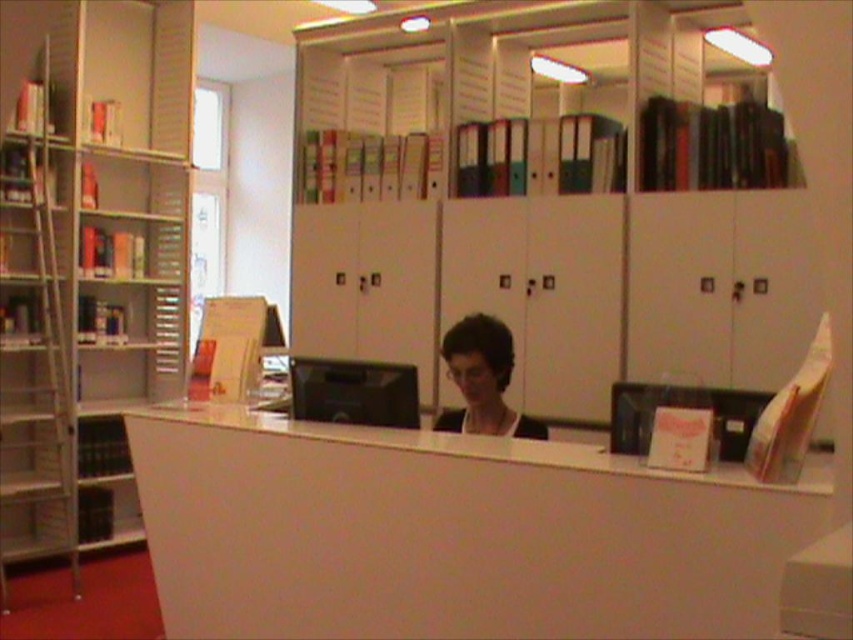
You are standing in the office and want to reach the metallic silver bookshelf at left and the matte black hair at center. Which object is closer to you?

The metallic silver bookshelf at left is closer to you since it is further to the viewer than the matte black hair at center.

You are a new employee in the office and need to place a folder on the white matte desk at center. However, there is a metallic silver bookshelf at left nearby. To ensure the folder doesn not fall off the desk, which object should you avoid placing it near the edge closest to?

You should avoid placing the folder near the edge of the white matte desk at center closest to the metallic silver bookshelf at left because the desk is positioned under the bookshelf. Placing items near the edge closest to the bookshelf might cause them to slide off since there is no obstruction there.

You are standing in front of the wall mounted storage unit and need to reach two points on it. The first point is at coordinates point [584,611] and the second point is at point [459,426]. Which point is easier to reach without moving your position?

Point [584,611] is closer to the viewer than point [459,426], so it is easier to reach without moving your position.